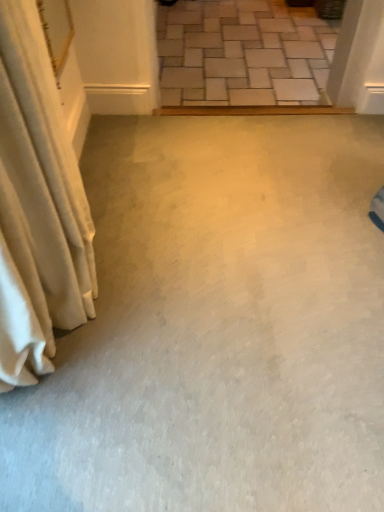
Where is `vacant space to the right of white fabric curtain at left`? This screenshot has width=384, height=512. vacant space to the right of white fabric curtain at left is located at coordinates (196, 306).